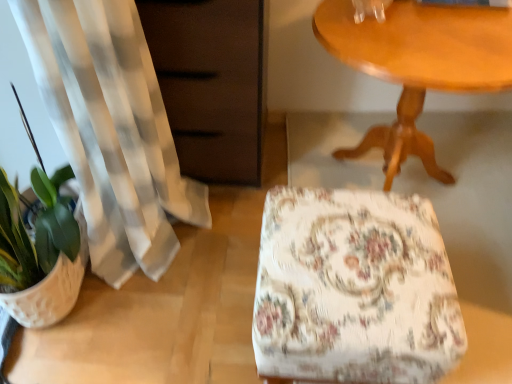
The image size is (512, 384). What do you see at coordinates (354, 289) in the screenshot? I see `floral fabric ottoman at center` at bounding box center [354, 289].

This screenshot has height=384, width=512. What do you see at coordinates (418, 64) in the screenshot? I see `wooden table at upper right` at bounding box center [418, 64].

Identify the location of floral fabric ottoman at center. This screenshot has height=384, width=512. (354, 289).

Does white textured flowerpot at lower left have a greater width compared to matte brown dresser at left?

In fact, white textured flowerpot at lower left might be narrower than matte brown dresser at left.

From the picture: How many degrees apart are the facing directions of white textured flowerpot at lower left and matte brown dresser at left?

The angle between the facing direction of white textured flowerpot at lower left and the facing direction of matte brown dresser at left is 91.8 degrees.

I want to click on flowerpot that appears on the left of matte brown dresser at left, so click(x=49, y=293).

How far apart are white textured flowerpot at lower left and matte brown dresser at left?

A distance of 22.70 inches exists between white textured flowerpot at lower left and matte brown dresser at left.

Is white textured flowerpot at lower left closer to the viewer compared to floral fabric ottoman at center?

No, white textured flowerpot at lower left is behind floral fabric ottoman at center.

Based on the photo, is white textured flowerpot at lower left situated inside floral fabric ottoman at center or outside?

white textured flowerpot at lower left lies outside floral fabric ottoman at center.

Is point (46, 280) positioned before point (343, 192)?

Yes.

Does floral fabric ottoman at center contain white textured flowerpot at lower left?

No, white textured flowerpot at lower left is not a part of floral fabric ottoman at center.

You are a GUI agent. You are given a task and a screenshot of the screen. Output one action in this format:
    pyautogui.click(x=<x>, y=<y>)
    Task: Click on the flowerpot below the floral fabric ottoman at center (from a real-world perspective)
    The height and width of the screenshot is (384, 512).
    Given the screenshot: What is the action you would take?
    pyautogui.click(x=49, y=293)

Is floral fabric ottoman at center shorter than white textured flowerpot at lower left?

No.

Considering the sizes of objects white textured flowerpot at lower left and wooden table at upper right in the image provided, who is taller, white textured flowerpot at lower left or wooden table at upper right?

With more height is wooden table at upper right.

Who is smaller, white textured flowerpot at lower left or wooden table at upper right?

white textured flowerpot at lower left.

From a real-world perspective, is white textured flowerpot at lower left physically below wooden table at upper right?

Yes, from a real-world perspective, white textured flowerpot at lower left is under wooden table at upper right.

Is white textured flowerpot at lower left aimed at wooden table at upper right?

No, white textured flowerpot at lower left is not turned towards wooden table at upper right.

In the scene shown: Which of these two, matte brown dresser at left or wooden table at upper right, is thinner?

Thinner between the two is matte brown dresser at left.

Is matte brown dresser at left with wooden table at upper right?

No, matte brown dresser at left is not making contact with wooden table at upper right.

Where is `dresser behind the wooden table at upper right`? The image size is (512, 384). dresser behind the wooden table at upper right is located at coordinates point(211,83).

From the picture: Between matte brown dresser at left and wooden table at upper right, which one has smaller size?

Smaller between the two is matte brown dresser at left.

Does matte brown dresser at left touch white textured flowerpot at lower left?

matte brown dresser at left and white textured flowerpot at lower left are clearly separated.

Considering the relative sizes of matte brown dresser at left and white textured flowerpot at lower left in the image provided, is matte brown dresser at left smaller than white textured flowerpot at lower left?

Incorrect, matte brown dresser at left is not smaller in size than white textured flowerpot at lower left.

Is white textured flowerpot at lower left at the back of matte brown dresser at left?

No.

Between matte brown dresser at left and white textured flowerpot at lower left, which one has less height?

white textured flowerpot at lower left.

From the picture: Which object is positioned more to the right, wooden table at upper right or white textured flowerpot at lower left?

From the viewer's perspective, wooden table at upper right appears more on the right side.

Does wooden table at upper right lie behind white textured flowerpot at lower left?

No.

Find the location of a particular element. table in front of the white textured flowerpot at lower left is located at coordinates (418, 64).

Which is closer, (347, 25) or (32, 320)?

Point (347, 25).

Image resolution: width=512 pixels, height=384 pixels. Find the location of `dresser on the right side of white textured flowerpot at lower left`. dresser on the right side of white textured flowerpot at lower left is located at coordinates (211, 83).

Where is `flowerpot on the left of the floral fabric ottoman at center`? flowerpot on the left of the floral fabric ottoman at center is located at coordinates (49, 293).

When comparing their distances from floral fabric ottoman at center, does white textured flowerpot at lower left or wooden table at upper right seem closer?

Based on the image, wooden table at upper right appears to be nearer to floral fabric ottoman at center.

From the image, which object appears to be nearer to floral fabric ottoman at center, matte brown dresser at left or white textured flowerpot at lower left?

matte brown dresser at left is positioned closer to the anchor floral fabric ottoman at center.

From the image, which object appears to be nearer to wooden table at upper right, matte brown dresser at left or floral fabric ottoman at center?

matte brown dresser at left lies closer to wooden table at upper right than the other object.

Based on their spatial positions, is wooden table at upper right or floral fabric ottoman at center further from white textured flowerpot at lower left?

wooden table at upper right lies further to white textured flowerpot at lower left than the other object.

Which object lies further to the anchor point matte brown dresser at left, floral fabric ottoman at center or white textured flowerpot at lower left?

white textured flowerpot at lower left is further to matte brown dresser at left.

Estimate the real-world distances between objects in this image. Which object is further from wooden table at upper right, floral fabric ottoman at center or white textured flowerpot at lower left?

The object further to wooden table at upper right is white textured flowerpot at lower left.

Consider the image. Considering their positions, is white textured flowerpot at lower left positioned further to wooden table at upper right than floral fabric ottoman at center?

The object further to wooden table at upper right is white textured flowerpot at lower left.

Based on their spatial positions, is wooden table at upper right or floral fabric ottoman at center further from matte brown dresser at left?

Based on the image, floral fabric ottoman at center appears to be further to matte brown dresser at left.

The image size is (512, 384). Identify the location of dresser between white textured flowerpot at lower left and floral fabric ottoman at center from left to right. pyautogui.click(x=211, y=83).

What are the coordinates of `dresser located between white textured flowerpot at lower left and wooden table at upper right in the left-right direction` in the screenshot? It's located at (211, 83).

Find the location of a particular element. This screenshot has height=384, width=512. rocking chair between matte brown dresser at left and wooden table at upper right is located at coordinates (354, 289).

What are the coordinates of `rocking chair between white textured flowerpot at lower left and wooden table at upper right` in the screenshot? It's located at (354, 289).